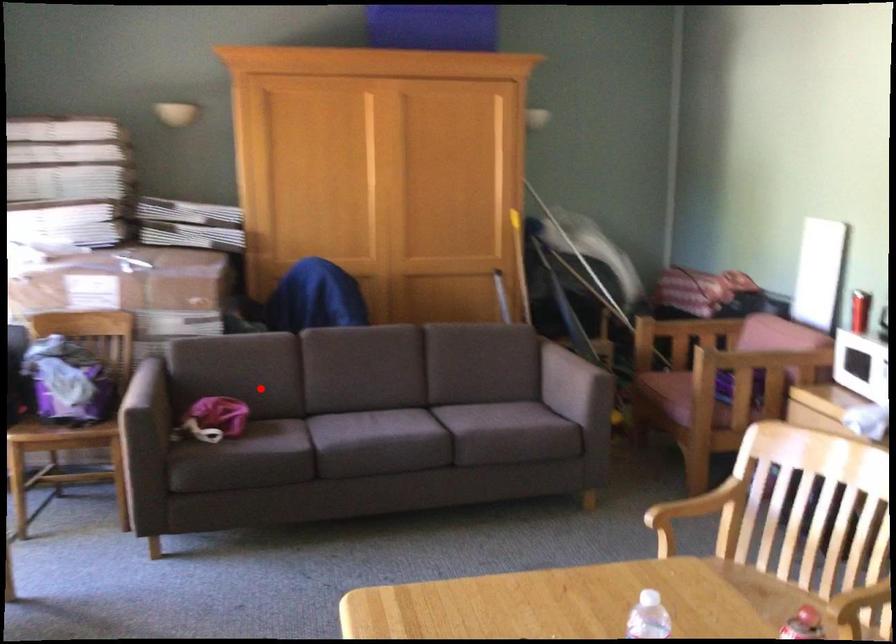
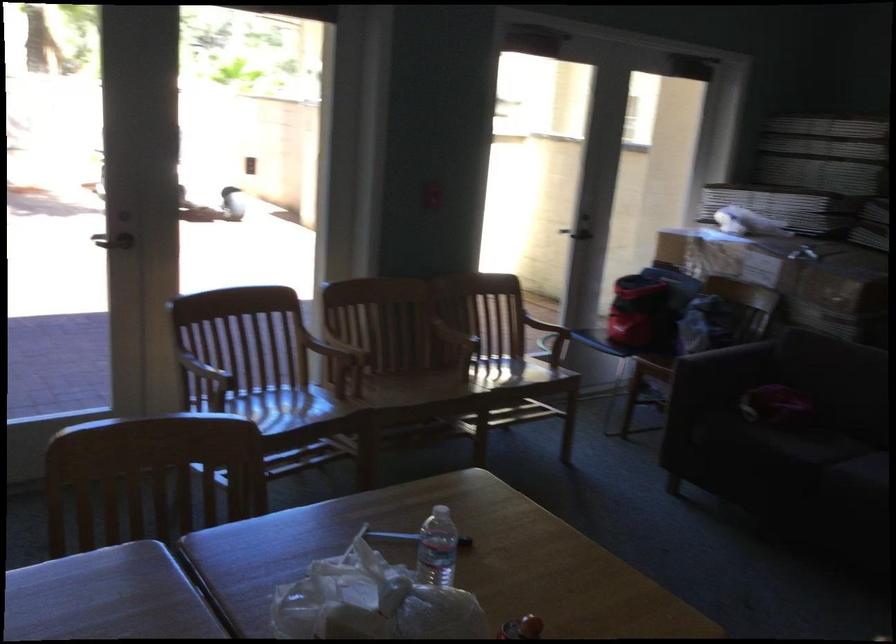
Find the pixel in the second image that matches the highlighted location in the first image.

(843, 392)